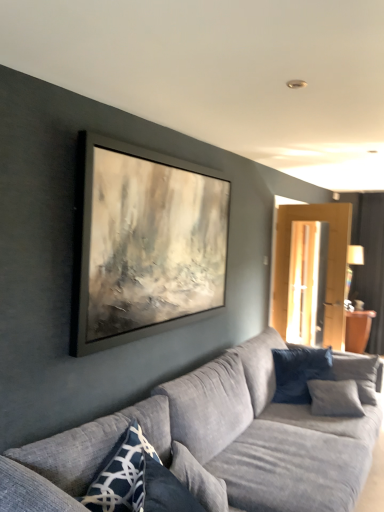
Question: From the image's perspective, is blue textured pillow at lower left, which appears as the first pillow when viewed from the front, on dark blue textured pillow at right, which appears as the 2th pillow when viewed from the back?

Choices:
 (A) yes
 (B) no

Answer: (B)

Question: From the image's perspective, would you say blue textured pillow at lower left, the 1th pillow when ordered from left to right, is shown under dark blue textured pillow at right, which ranks as the third pillow in left-to-right order?

Choices:
 (A) no
 (B) yes

Answer: (B)

Question: Is blue textured pillow at lower left, the third pillow from the right, with dark blue textured pillow at right, which appears as the 2th pillow when viewed from the back?

Choices:
 (A) yes
 (B) no

Answer: (B)

Question: Is blue textured pillow at lower left, which ranks as the third pillow in back-to-front order, positioned behind dark blue textured pillow at right, the first pillow when ordered from right to left?

Choices:
 (A) yes
 (B) no

Answer: (B)

Question: Does blue textured pillow at lower left, which appears as the first pillow when viewed from the front, appear on the left side of dark blue textured pillow at right, which appears as the 2th pillow when viewed from the back?

Choices:
 (A) no
 (B) yes

Answer: (B)

Question: Is dark blue textured pillow at right, which appears as the 2th pillow when viewed from the back, surrounded by blue textured pillow at lower left, the third pillow from the right?

Choices:
 (A) no
 (B) yes

Answer: (A)

Question: Can you confirm if dark blue textured pillow at right, the first pillow when ordered from right to left, is smaller than textured gray couch at center?

Choices:
 (A) yes
 (B) no

Answer: (A)

Question: Is dark blue textured pillow at right, which is the 2th pillow in front-to-back order, beside textured gray couch at center?

Choices:
 (A) no
 (B) yes

Answer: (A)

Question: Does dark blue textured pillow at right, which appears as the 2th pillow when viewed from the back, have a lesser width compared to textured gray couch at center?

Choices:
 (A) yes
 (B) no

Answer: (A)

Question: Is dark blue textured pillow at right, which is the 2th pillow in front-to-back order, closer to the viewer compared to textured gray couch at center?

Choices:
 (A) yes
 (B) no

Answer: (B)

Question: Is dark blue textured pillow at right, which appears as the 2th pillow when viewed from the back, aimed at textured gray couch at center?

Choices:
 (A) no
 (B) yes

Answer: (B)

Question: Is dark blue textured pillow at right, which appears as the 2th pillow when viewed from the back, looking in the opposite direction of textured gray couch at center?

Choices:
 (A) yes
 (B) no

Answer: (A)

Question: From a real-world perspective, is dark blue fabric pillow at right, positioned as the 1th pillow in back-to-front order, physically below textured gray couch at center?

Choices:
 (A) no
 (B) yes

Answer: (A)